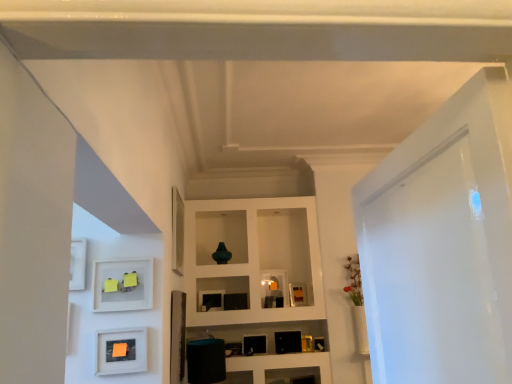
Question: Is white glossy door at right thinner than white matte frame at lower left?

Choices:
 (A) no
 (B) yes

Answer: (A)

Question: Is white glossy door at right to the right of white matte frame at lower left from the viewer's perspective?

Choices:
 (A) yes
 (B) no

Answer: (A)

Question: Are white glossy door at right and white matte frame at lower left located far from each other?

Choices:
 (A) yes
 (B) no

Answer: (A)

Question: Does white glossy door at right have a greater width compared to white matte frame at lower left?

Choices:
 (A) yes
 (B) no

Answer: (A)

Question: Is white glossy door at right facing towards white matte frame at lower left?

Choices:
 (A) no
 (B) yes

Answer: (A)

Question: Based on their sizes in the image, would you say matte black picture frame at center, the third picture frame positioned from the left, is bigger or smaller than matte orange paper at lower left, which appears as the 1th picture frame when viewed from the front?

Choices:
 (A) big
 (B) small

Answer: (B)

Question: Considering the positions of point (293, 299) and point (139, 352), is point (293, 299) closer or farther from the camera than point (139, 352)?

Choices:
 (A) closer
 (B) farther

Answer: (B)

Question: From the image's perspective, relative to matte orange paper at lower left, arranged as the 1th picture frame when viewed from the left, is matte black picture frame at center, the third picture frame positioned from the left, above or below?

Choices:
 (A) above
 (B) below

Answer: (B)

Question: Is matte black picture frame at center, which appears as the 1th picture frame when viewed from the right, taller or shorter than matte orange paper at lower left, which appears as the 1th picture frame when viewed from the front?

Choices:
 (A) short
 (B) tall

Answer: (A)

Question: Is matte black picture frame at center, which appears as the 1th picture frame when viewed from the right, inside or outside of white glossy door at right?

Choices:
 (A) outside
 (B) inside

Answer: (A)

Question: Is point (295, 286) positioned closer to the camera than point (417, 134)?

Choices:
 (A) farther
 (B) closer

Answer: (A)

Question: From the image's perspective, is matte black picture frame at center, which ranks as the third picture frame in front-to-back order, above or below white glossy door at right?

Choices:
 (A) below
 (B) above

Answer: (A)

Question: Looking at their shapes, would you say matte black picture frame at center, the third picture frame positioned from the left, is wider or thinner than white glossy door at right?

Choices:
 (A) wide
 (B) thin

Answer: (B)

Question: Considering the positions of white glossy door at right and matte black picture frame at center, which ranks as the third picture frame in front-to-back order, in the image, is white glossy door at right wider or thinner than matte black picture frame at center, which ranks as the third picture frame in front-to-back order,?

Choices:
 (A) thin
 (B) wide

Answer: (B)

Question: From a real-world perspective, is white glossy door at right above or below matte black picture frame at center, the third picture frame positioned from the left?

Choices:
 (A) above
 (B) below

Answer: (A)